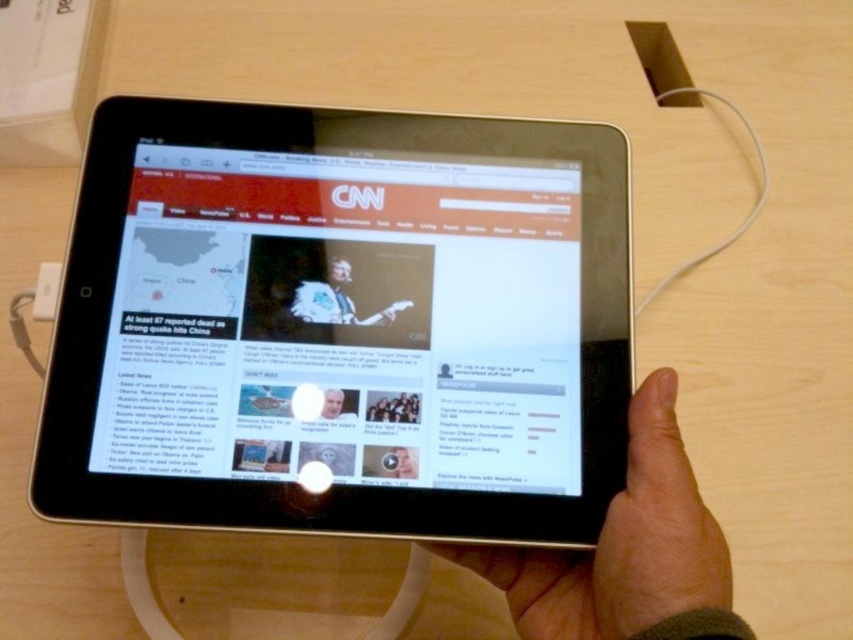
You are designing a protective case for the silver metallic tablet at center. The case must accommodate the smooth skin hand at lower right when holding it. Based on the scene, will the case need to be taller than the tablet to ensure the hand has enough space?

The silver metallic tablet at center is much taller than the smooth skin hand at lower right, so the case does not need to be taller than the tablet to accommodate the hand.

In the scene shown: You are a robotic arm trying to pick up the silver metallic tablet at center and the smooth skin hand at lower right. Which object is closer to your starting position at the left side of the scene?

The silver metallic tablet at center is closer to your starting position at the left side of the scene because it is positioned to the left of the smooth skin hand at lower right.

You are a virtual assistant trying to determine if the silver metallic tablet at center is being held by the smooth skin hand at lower right. Based on the scene description, can you confirm this?

The silver metallic tablet at center is positioned over smooth skin hand at lower right, so yes, the smooth skin hand at lower right is holding the silver metallic tablet at center.